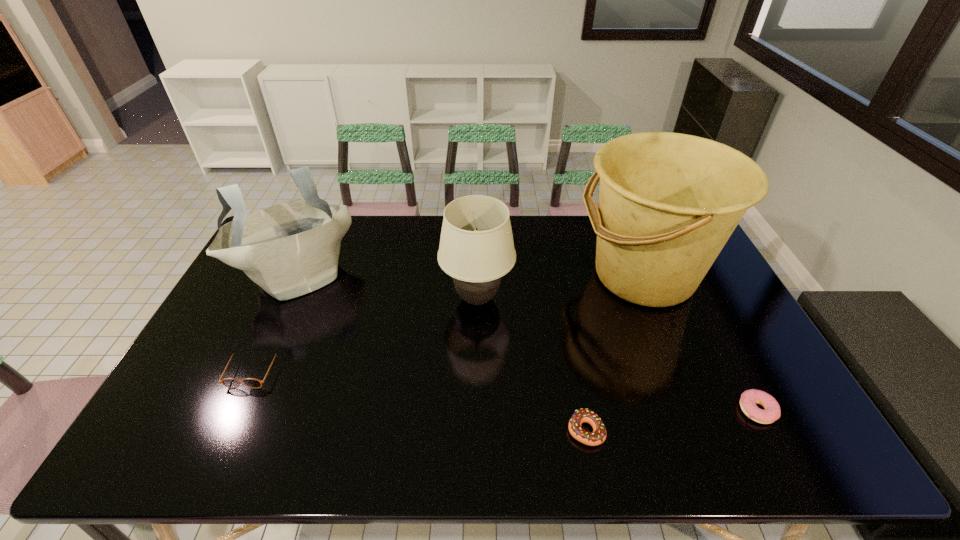
Locate an element on the screen. The image size is (960, 540). free point located 0.140m on the left of the third object from left to right is located at coordinates (396, 299).

Locate an element on the screen. vacant point located on the front-facing side of the sunglasses is located at coordinates (230, 420).

Locate an element on the screen. This screenshot has height=540, width=960. vacant space located 0.340m on the right of the third object from right to left is located at coordinates (746, 430).

The image size is (960, 540). I want to click on vacant area situated on the back of the right doughnut, so click(x=731, y=360).

Locate an element on the screen. The width and height of the screenshot is (960, 540). bucket present at the far edge is located at coordinates (668, 202).

Image resolution: width=960 pixels, height=540 pixels. I want to click on shopping bag that is at the far edge, so click(290, 249).

You are a GUI agent. You are given a task and a screenshot of the screen. Output one action in this format:
    pyautogui.click(x=<x>, y=<y>)
    Task: Click on the object located at the near edge
    This screenshot has width=960, height=540.
    Given the screenshot: What is the action you would take?
    point(598,436)

This screenshot has width=960, height=540. What are the coordinates of `shopping bag positioned at the left edge` in the screenshot? It's located at (290, 249).

You are a GUI agent. You are given a task and a screenshot of the screen. Output one action in this format:
    pyautogui.click(x=<x>, y=<y>)
    Task: Click on the sunglasses that is at the left edge
    This screenshot has height=540, width=960.
    Given the screenshot: What is the action you would take?
    pyautogui.click(x=232, y=383)

I want to click on bucket located in the right edge section of the desktop, so click(x=668, y=202).